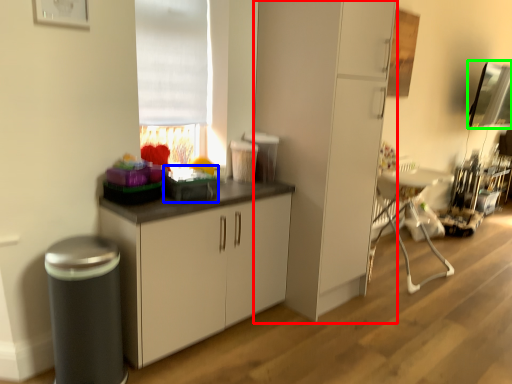
Question: Which object is the farthest from cabinetry (highlighted by a red box)? Choose among these: appliance (highlighted by a blue box) or window screen (highlighted by a green box).

Choices:
 (A) appliance
 (B) window screen

Answer: (B)